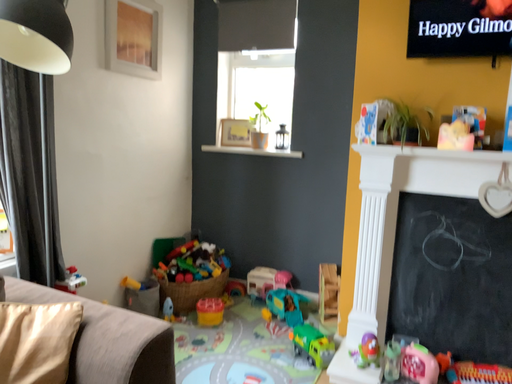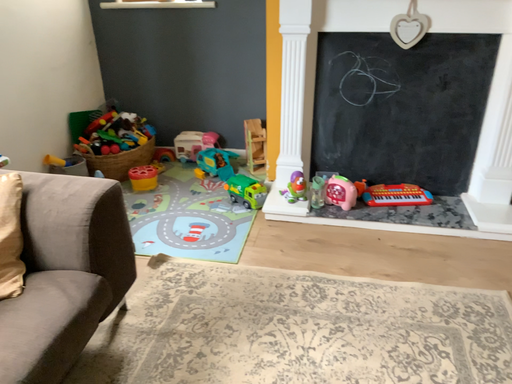
Question: How did the camera likely rotate when shooting the video?

Choices:
 (A) rotated right
 (B) rotated left

Answer: (A)